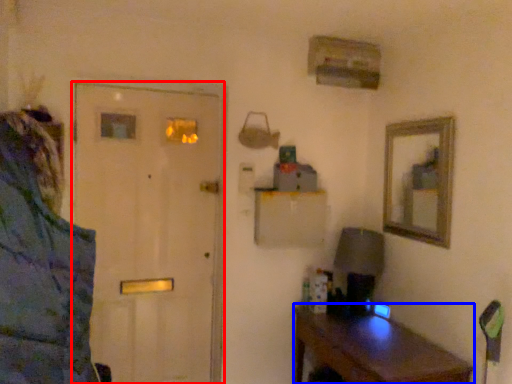
Question: Which object is closer to the camera taking this photo, door (highlighted by a red box) or desk (highlighted by a blue box)?

Choices:
 (A) door
 (B) desk

Answer: (B)